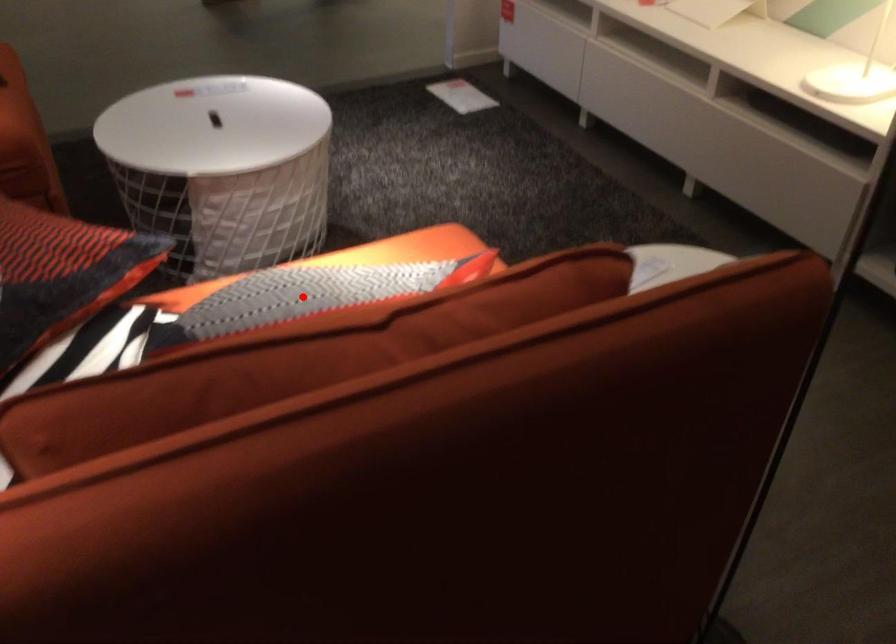
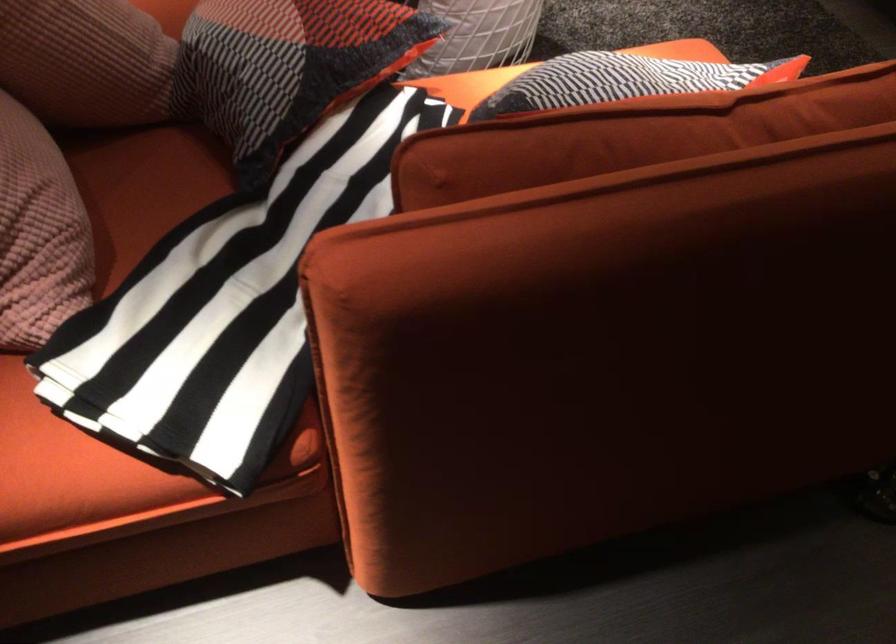
Locate, in the second image, the point that corresponds to the highlighted location in the first image.

(623, 80)